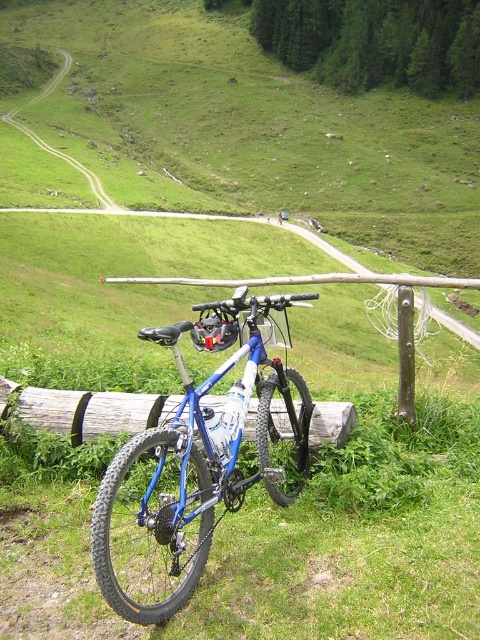
You are planning to transport the blue metallic mountain bike at center and the wooden log at center in the back of your pickup truck. The truck bed can only fit items that are smaller than the bike. Which item should you place first in the truck bed to maximize space efficiency?

The wooden log at center should be placed first in the truck bed because the blue metallic mountain bike at center is larger in size, so placing the smaller item first allows more space for the larger bike to be positioned around it.

You are a hiker who wants to take a break. You see the blue metallic mountain bike at center and the wooden log at center. Which object can you sit on?

The wooden log at center is the object you can sit on, as the blue metallic mountain bike at center is positioned under it, likely making the log more accessible for sitting.

You are planning to transport both the blue metallic mountain bike at center and the wooden log at center in the back of a pickup truck. The truck bed has a width of 1.2 meters. Which object will fit better in the truck bed based on their widths?

The blue metallic mountain bike at center is thinner than the wooden log at center, so the blue metallic mountain bike at center will fit better in the truck bed.